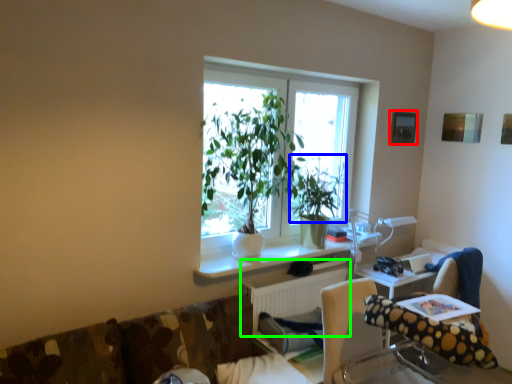
Question: Considering the real-world distances, which object is farthest from picture frame (highlighted by a red box)? vegetation (highlighted by a blue box) or radiator (highlighted by a green box)?

Choices:
 (A) vegetation
 (B) radiator

Answer: (B)